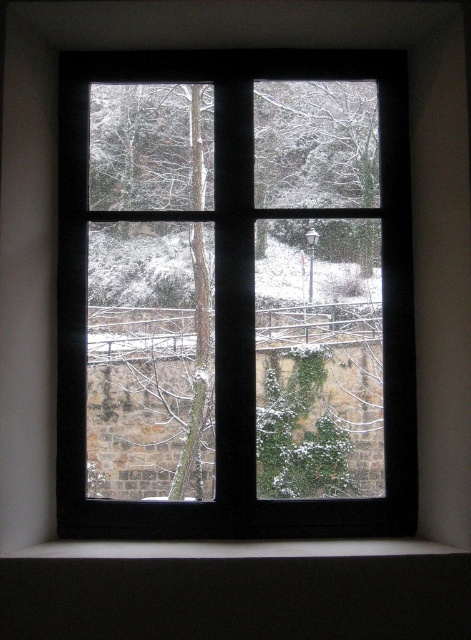
You are an interior designer planning to place a small potted plant on the white matte window sill at lower center. Considering the size of the window sill, will the plant with a height of 30 cm fit vertically without touching the black wood window at center?

The black wood window at center is much taller than the white matte window sill at lower center. Since the plant is only 30 cm tall, it will not touch the window and will fit vertically.

You are an interior designer planning to hang a painting on the wall where the black wood window at center is located. The painting will be placed 0.5 meters to the right of the window. Given the window is at point 0.463, 0.499, what coordinate should you mark for the painting?

The painting should be marked at coordinate 0.5 meters to the right of the black wood window at center, which is located at point (235, 296). Since moving to the right increases the x coordinate, the new coordinate would be approximately 0.463 plus 0.5 meters in the x direction. However, without knowing the scale of the coordinate system, an exact coordinate can not be determined. Please provide the scale of the coordinate system to calculate the precise position.

You are standing in a room with a window. You see a point at coordinates point (235, 296). Where is this point located in relation to the black wood window at center?

The point (235, 296) is on the black wood window at center.